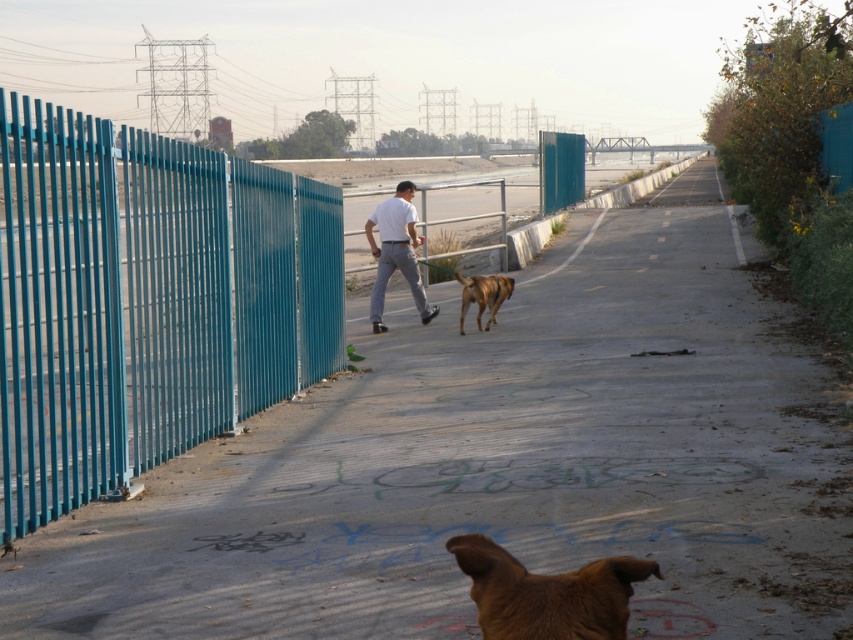
Does brown furry dog at lower center appear on the left side of white matte shirt at center?

No, brown furry dog at lower center is not to the left of white matte shirt at center.

What do you see at coordinates (547, 593) in the screenshot? Image resolution: width=853 pixels, height=640 pixels. I see `brown furry dog at lower center` at bounding box center [547, 593].

Between point (567, 616) and point (413, 228), which one is positioned in front?

Point (567, 616) is in front.

You are a GUI agent. You are given a task and a screenshot of the screen. Output one action in this format:
    pyautogui.click(x=<x>, y=<y>)
    Task: Click on the brown furry dog at lower center
    
    Given the screenshot: What is the action you would take?
    pyautogui.click(x=547, y=593)

Who is taller, metallic blue fence at left or brown fur dog at center?

With more height is metallic blue fence at left.

Who is more distant from viewer, (189, 161) or (490, 308)?

The point (490, 308) is more distant.

Who is more forward, (195, 435) or (480, 276)?

Point (195, 435) is more forward.

Where is `metallic blue fence at left`? metallic blue fence at left is located at coordinates (146, 301).

Is metallic blue fence at left wider than white matte shirt at center?

No.

Which is behind, point (151, 147) or point (398, 250)?

Positioned behind is point (398, 250).

Between point (144, 140) and point (416, 278), which one is positioned in front?

Point (144, 140) is more forward.

Where is `metallic blue fence at left`? This screenshot has width=853, height=640. metallic blue fence at left is located at coordinates (146, 301).